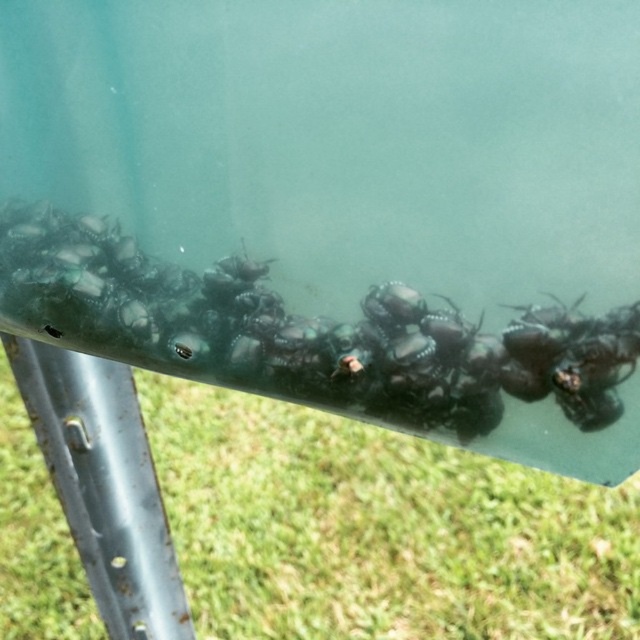
You are a gardener who wants to protect the green glossy snails at center from drying out. Since the green grass at lower center is nearby, can you use it to provide shade for the snails?

The green grass at lower center is larger in size compared to the green glossy snails at center, so it can provide sufficient shade to protect them from drying out.

You are a gardener trying to determine the spacing between plants. You observe the green grass at lower center and the green glossy snails at center in the image. Which object has a greater width?

The green grass at lower center has a greater width than the green glossy snails at center according to the description provided.